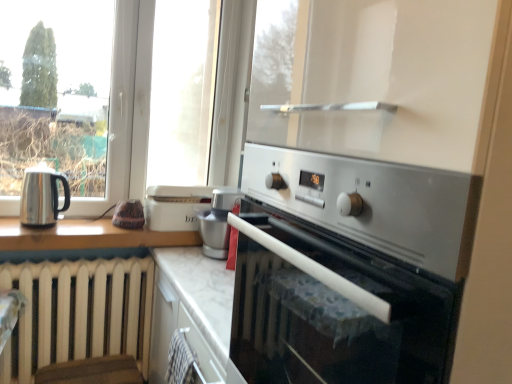
Question: Would you say satin silver oven at center is part of satin silver appliance at center's contents?

Choices:
 (A) yes
 (B) no

Answer: (B)

Question: Is satin silver appliance at center turned away from satin silver oven at center?

Choices:
 (A) no
 (B) yes

Answer: (A)

Question: Is the position of satin silver appliance at center more distant than that of satin silver oven at center?

Choices:
 (A) yes
 (B) no

Answer: (A)

Question: Can you confirm if satin silver appliance at center is wider than satin silver oven at center?

Choices:
 (A) no
 (B) yes

Answer: (A)

Question: Would you say satin silver appliance at center is a long distance from satin silver oven at center?

Choices:
 (A) yes
 (B) no

Answer: (B)

Question: Considering the relative positions of satin silver appliance at center and satin silver oven at center in the image provided, is satin silver appliance at center to the right of satin silver oven at center from the viewer's perspective?

Choices:
 (A) yes
 (B) no

Answer: (B)

Question: Does satin silver appliance at center have a lesser width compared to shiny metallic kettle at left?

Choices:
 (A) no
 (B) yes

Answer: (A)

Question: Is satin silver appliance at center surrounding shiny metallic kettle at left?

Choices:
 (A) yes
 (B) no

Answer: (B)

Question: Could you tell me if satin silver appliance at center is facing shiny metallic kettle at left?

Choices:
 (A) no
 (B) yes

Answer: (B)

Question: Is satin silver appliance at center in front of shiny metallic kettle at left?

Choices:
 (A) yes
 (B) no

Answer: (B)

Question: Is satin silver appliance at center looking in the opposite direction of shiny metallic kettle at left?

Choices:
 (A) no
 (B) yes

Answer: (A)

Question: Is the position of satin silver appliance at center more distant than that of shiny metallic kettle at left?

Choices:
 (A) yes
 (B) no

Answer: (A)

Question: Is satin silver oven at center to the left of satin silver appliance at center from the viewer's perspective?

Choices:
 (A) yes
 (B) no

Answer: (B)